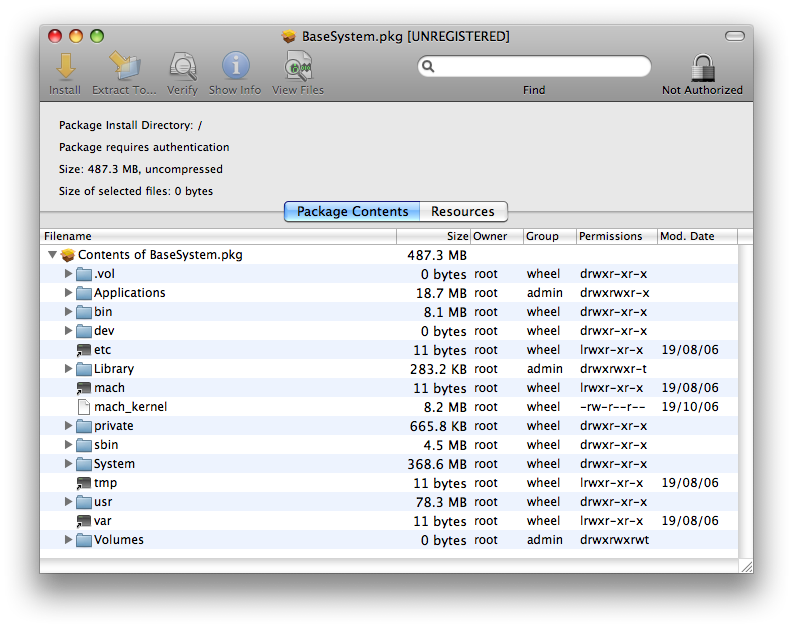
You are a GUI agent. You are given a task and a screenshot of the screen. Output one action in this format:
    pyautogui.click(x=<x>, y=<y>)
    Task: Click on the folders
    The height and width of the screenshot is (628, 793).
    Given the screenshot: What is the action you would take?
    pyautogui.click(x=87, y=272), pyautogui.click(x=83, y=289), pyautogui.click(x=83, y=306), pyautogui.click(x=82, y=330), pyautogui.click(x=86, y=372), pyautogui.click(x=83, y=423), pyautogui.click(x=83, y=441), pyautogui.click(x=82, y=463), pyautogui.click(x=79, y=501), pyautogui.click(x=82, y=537)